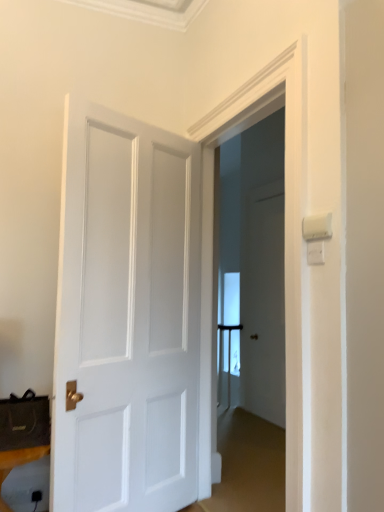
The width and height of the screenshot is (384, 512). In order to click on white matte door at center in this screenshot , I will do `click(126, 316)`.

This screenshot has width=384, height=512. What do you see at coordinates (126, 316) in the screenshot?
I see `white matte door at center` at bounding box center [126, 316].

The image size is (384, 512). Describe the element at coordinates (18, 464) in the screenshot. I see `black plastic speaker at lower left` at that location.

You are a GUI agent. You are given a task and a screenshot of the screen. Output one action in this format:
    pyautogui.click(x=<x>, y=<y>)
    Task: Click on the black plastic speaker at lower left
    This screenshot has height=512, width=384.
    Given the screenshot: What is the action you would take?
    pyautogui.click(x=18, y=464)

This screenshot has height=512, width=384. I want to click on white matte door at center, so click(126, 316).

In the scene shown: Would you say black plastic speaker at lower left is to the left or to the right of white matte door at center in the picture?

In the image, black plastic speaker at lower left appears on the left side of white matte door at center.

Is the position of black plastic speaker at lower left more distant than that of white matte door at center?

No, it is not.

Is point (39, 450) positioned behind point (150, 276)?

No, (39, 450) is in front of (150, 276).

From the image's perspective, is black plastic speaker at lower left above or below white matte door at center?

Clearly, from the image's perspective, black plastic speaker at lower left is below white matte door at center.

From a real-world perspective, is black plastic speaker at lower left physically above white matte door at center?

No, from a real-world perspective, black plastic speaker at lower left is not over white matte door at center

Does black plastic speaker at lower left have a greater width compared to white matte door at center?

Indeed, black plastic speaker at lower left has a greater width compared to white matte door at center.

Is black plastic speaker at lower left taller than white matte door at center?

No, black plastic speaker at lower left is not taller than white matte door at center.

Is black plastic speaker at lower left bigger than white matte door at center?

Incorrect, black plastic speaker at lower left is not larger than white matte door at center.

Would you say black plastic speaker at lower left is inside or outside white matte door at center?

black plastic speaker at lower left is not enclosed by white matte door at center.

Is black plastic speaker at lower left not close to white matte door at center?

Actually, black plastic speaker at lower left and white matte door at center are a little close together.

Is white matte door at center at the back of black plastic speaker at lower left?

black plastic speaker at lower left does not have its back to white matte door at center.

How distant is black plastic speaker at lower left from white matte door at center?

black plastic speaker at lower left is 32.30 inches away from white matte door at center.

At what (x,y) coordinates should I click in order to perform the action: click on furniture in front of the white matte door at center. Please return your answer as a coordinate pair (x, y). Looking at the image, I should click on (18, 464).

Considering the positions of objects white matte door at center and black plastic speaker at lower left in the image provided, who is more to the right, white matte door at center or black plastic speaker at lower left?

From the viewer's perspective, white matte door at center appears more on the right side.

Is white matte door at center in front of or behind black plastic speaker at lower left in the image?

In the image, white matte door at center appears behind black plastic speaker at lower left.

Is point (189, 144) closer or farther from the camera than point (8, 455)?

Point (189, 144) is positioned farther from the camera compared to point (8, 455).

From the image's perspective, would you say white matte door at center is positioned over black plastic speaker at lower left?

Indeed, from the image's perspective, white matte door at center is shown above black plastic speaker at lower left.

From a real-world perspective, which object stands above the other?

white matte door at center.

From the picture: Considering the sizes of objects white matte door at center and black plastic speaker at lower left in the image provided, who is thinner, white matte door at center or black plastic speaker at lower left?

white matte door at center.

Can you confirm if white matte door at center is taller than black plastic speaker at lower left?

Correct, white matte door at center is much taller as black plastic speaker at lower left.

Between white matte door at center and black plastic speaker at lower left, which one has larger size?

Bigger between the two is white matte door at center.

Is white matte door at center completely or partially outside of black plastic speaker at lower left?

Yes, white matte door at center is outside of black plastic speaker at lower left.

Is white matte door at center positioned far away from black plastic speaker at lower left?

Actually, white matte door at center and black plastic speaker at lower left are a little close together.

Is white matte door at center aimed at black plastic speaker at lower left?

No, white matte door at center does not turn towards black plastic speaker at lower left.

Find the location of a particular element. Image resolution: width=384 pixels, height=512 pixels. furniture on the left of white matte door at center is located at coordinates (18, 464).

Find the location of a particular element. This screenshot has width=384, height=512. furniture below the white matte door at center (from a real-world perspective) is located at coordinates (18, 464).

Find the location of a particular element. The height and width of the screenshot is (512, 384). furniture lying on the left of white matte door at center is located at coordinates (18, 464).